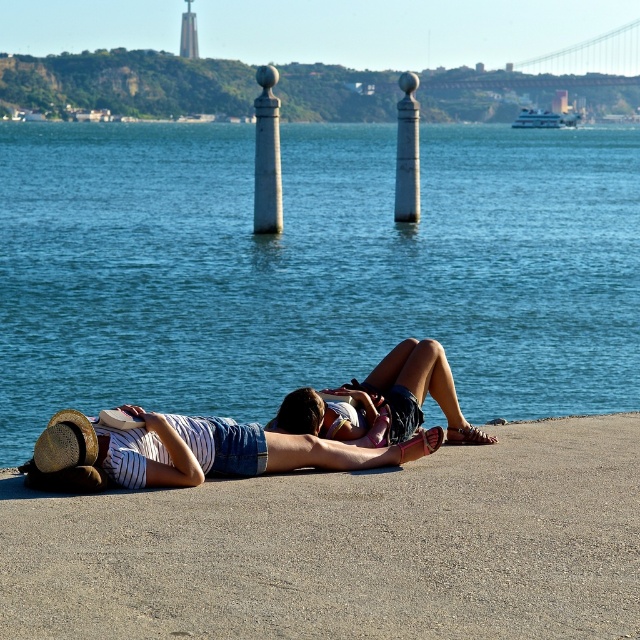
Question: Which is nearer to the denim shorts at center?

Choices:
 (A) blue water at center
 (B) denim shorts at lower center

Answer: (B)

Question: Is smooth concrete dock at lower center wider than denim shorts at lower center?

Choices:
 (A) no
 (B) yes

Answer: (B)

Question: Which point is closer to the camera taking this photo?

Choices:
 (A) click(x=502, y=380)
 (B) click(x=628, y=614)
 (C) click(x=410, y=342)
 (D) click(x=234, y=449)

Answer: (B)

Question: Where is blue water at center located in relation to denim shorts at center in the image?

Choices:
 (A) left
 (B) right

Answer: (B)

Question: Does denim shorts at center come in front of white glossy post at center?

Choices:
 (A) no
 (B) yes

Answer: (B)

Question: Which point is closer to the camera?

Choices:
 (A) blue water at center
 (B) denim shorts at lower center
 (C) smooth concrete dock at lower center

Answer: (C)